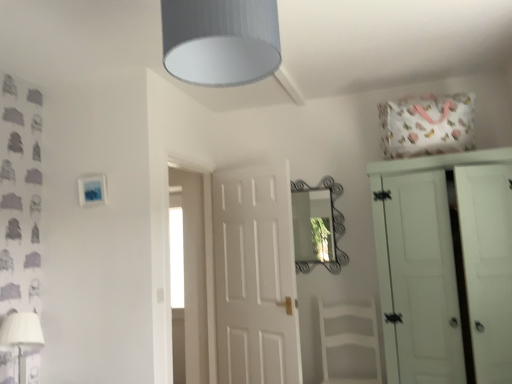
Question: From their relative heights in the image, would you say white painted wood wardrobe at right is taller or shorter than white wood armchair at center?

Choices:
 (A) short
 (B) tall

Answer: (B)

Question: Looking at their shapes, would you say white painted wood wardrobe at right is wider or thinner than white wood armchair at center?

Choices:
 (A) thin
 (B) wide

Answer: (B)

Question: Which object is the closest to the white matte door at center?

Choices:
 (A) white fabric lampshade at lower left
 (B) white wood armchair at center
 (C) white painted wood wardrobe at right
 (D) gray textured lampshade at upper center

Answer: (B)

Question: Based on their relative distances, which object is farther from the white fabric lampshade at lower left?

Choices:
 (A) white wood armchair at center
 (B) white matte door at center
 (C) white painted wood wardrobe at right
 (D) gray textured lampshade at upper center

Answer: (C)